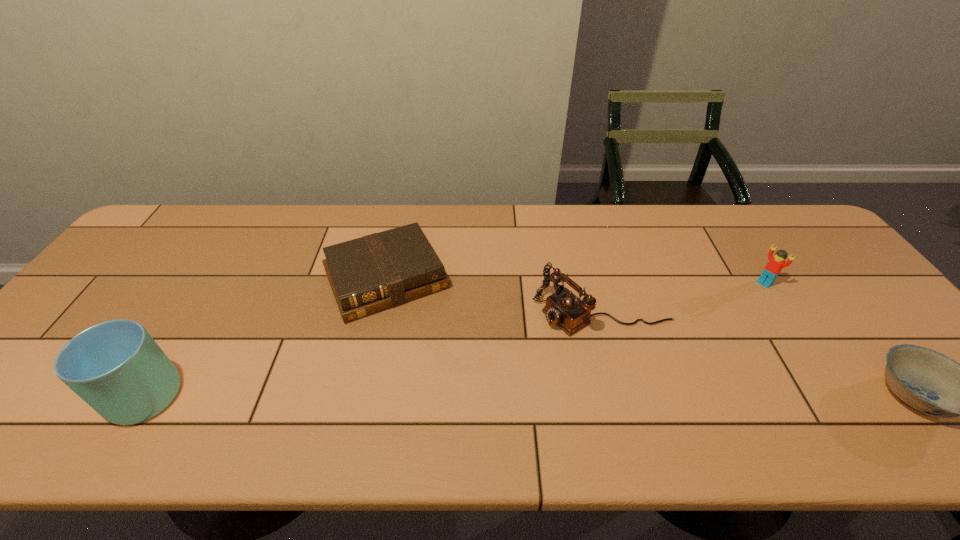
Locate an element on the screen. This screenshot has height=540, width=960. free space on the desktop that is between the mug and the bowl and is positioned on the dial of the telephone is located at coordinates (466, 395).

I want to click on vacant space on the desktop that is between the tallest object and the bowl and is positioned on the spine side of the Bible, so click(x=444, y=395).

Locate an element on the screen. vacant spot on the desktop that is between the tallest object and the rightmost object and is positioned on the face of the Lego is located at coordinates (623, 395).